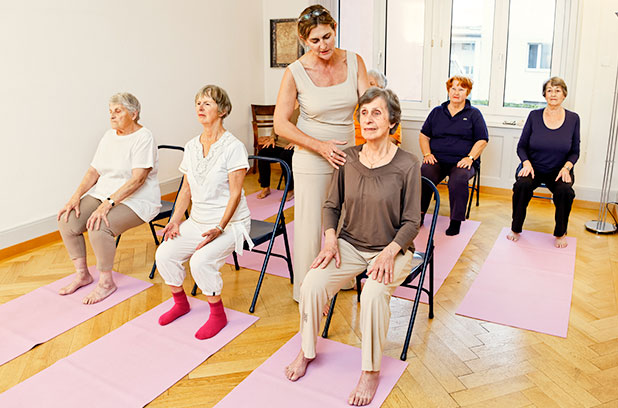
You are a GUI agent. You are given a task and a screenshot of the screen. Output one action in this format:
    pyautogui.click(x=<x>, y=<y>)
    Task: Click on the sock
    The height and width of the screenshot is (408, 618).
    Given the screenshot: What is the action you would take?
    pyautogui.click(x=178, y=302), pyautogui.click(x=218, y=322), pyautogui.click(x=453, y=227), pyautogui.click(x=421, y=218)